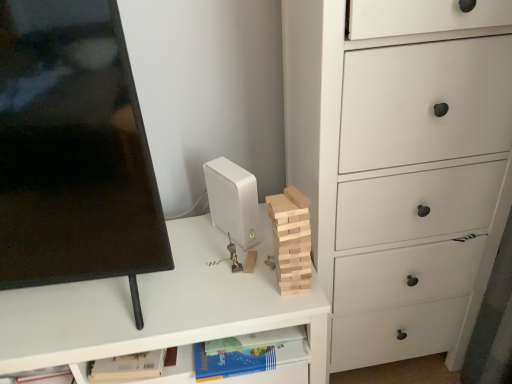
The height and width of the screenshot is (384, 512). I want to click on vacant area that lies between black glossy computer monitor at left and natural wood block at center, so click(223, 287).